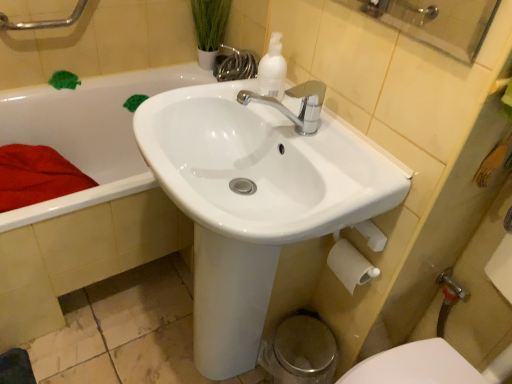
Find the location of `vacant area that is in front of polished chrome faucet at center`. vacant area that is in front of polished chrome faucet at center is located at coordinates (319, 181).